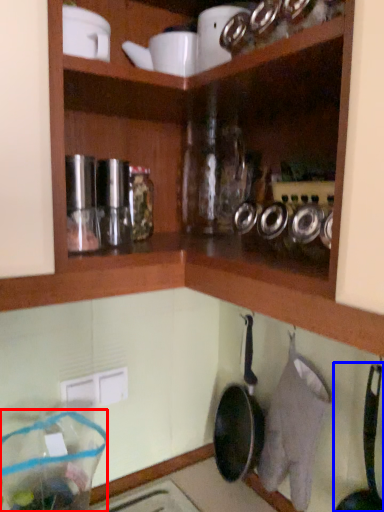
Question: Which of the following is the farthest to the observer, glass jar (highlighted by a red box) or frying pan (highlighted by a blue box)?

Choices:
 (A) glass jar
 (B) frying pan

Answer: (A)